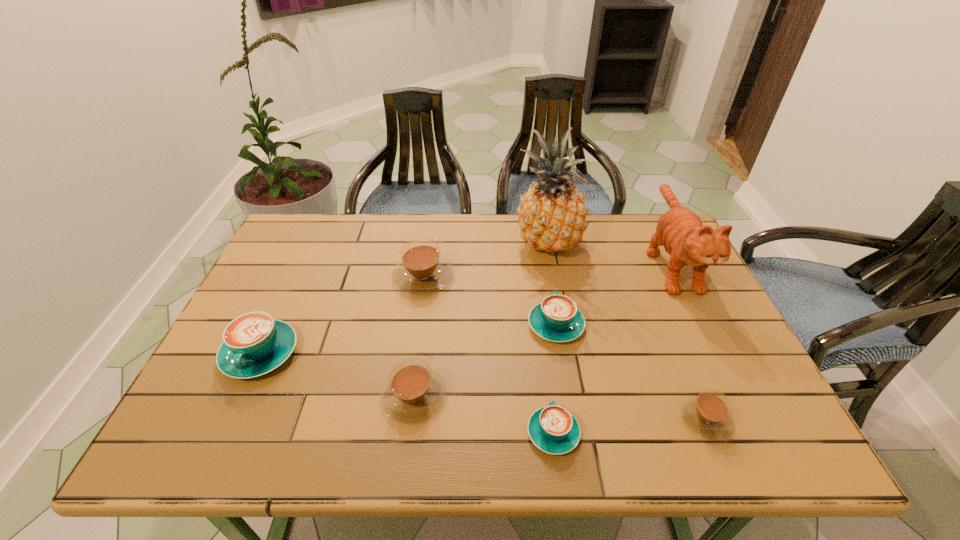
Locate an element on the screen. The width and height of the screenshot is (960, 540). brown cappuccino identified as the closest to the cat is located at coordinates (708, 414).

Locate an element on the screen. The width and height of the screenshot is (960, 540). the second closest turquoise cappuccino to the rightmost cappuccino is located at coordinates (554, 430).

Identify which turquoise cappuccino is the second closest to the second smallest brown cappuccino. Please provide its 2D coordinates. Your answer should be formatted as a tuple, i.e. [(x, y)], where the tuple contains the x and y coordinates of a point satisfying the conditions above.

[(556, 318)]

The image size is (960, 540). What are the coordinates of `free space that satisfies the following two spatial constraints: 1. with the handle on the right side of the second smallest brown cappuccino; 2. on the left side of the leftmost turquoise cappuccino` in the screenshot? It's located at (240, 397).

Where is `free space that satisfies the following two spatial constraints: 1. with the handle on the right side of the yellow pineapple; 2. on the right side of the second biggest turquoise cappuccino`? The height and width of the screenshot is (540, 960). free space that satisfies the following two spatial constraints: 1. with the handle on the right side of the yellow pineapple; 2. on the right side of the second biggest turquoise cappuccino is located at coordinates coord(542,244).

Image resolution: width=960 pixels, height=540 pixels. Identify the location of free spot that satisfies the following two spatial constraints: 1. with the handle on the right side of the leftmost turquoise cappuccino; 2. on the right side of the second smallest brown cappuccino. (240, 397).

The image size is (960, 540). What are the coordinates of `vacant space that satisfies the following two spatial constraints: 1. on the back side of the yellow pineapple; 2. on the right side of the biggest brown cappuccino` in the screenshot? It's located at (428, 244).